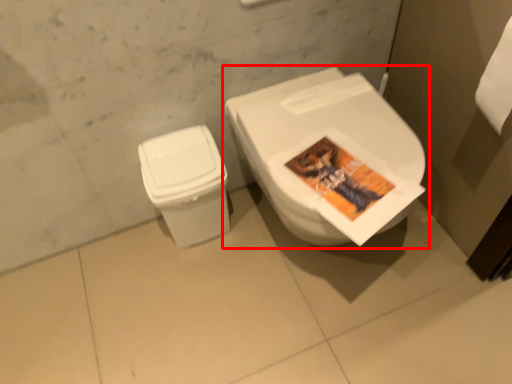
Question: From the image, what is the correct spatial relationship of toilet (annotated by the red box) in relation to toilet bowl?

Choices:
 (A) right
 (B) left

Answer: (A)